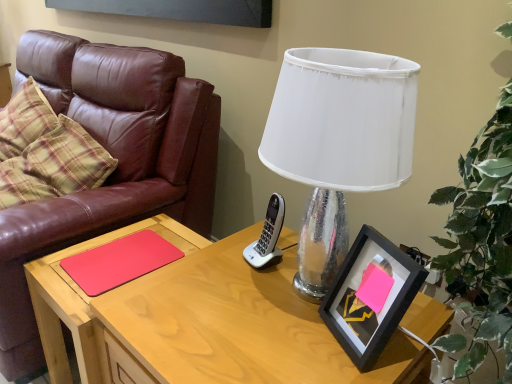
Question: From a real-world perspective, is red matte wood side table at left physically located above or below matte pink notepad at center?

Choices:
 (A) below
 (B) above

Answer: (A)

Question: Looking at their shapes, would you say red matte wood side table at left is wider or thinner than matte pink notepad at center?

Choices:
 (A) thin
 (B) wide

Answer: (B)

Question: Considering the real-world distances, which object is closest to the plaid fabric pillow at left?

Choices:
 (A) black matte picture frame at right
 (B) matte pink notepad at center
 (C) white fabric lampshade at upper center
 (D) wooden desk at center
 (E) red matte wood side table at left

Answer: (E)

Question: Considering the real-world distances, which object is farthest from the plaid fabric pillow at left?

Choices:
 (A) wooden desk at center
 (B) matte pink notepad at center
 (C) white fabric lampshade at upper center
 (D) red matte wood side table at left
 (E) brown leather couch at left

Answer: (C)